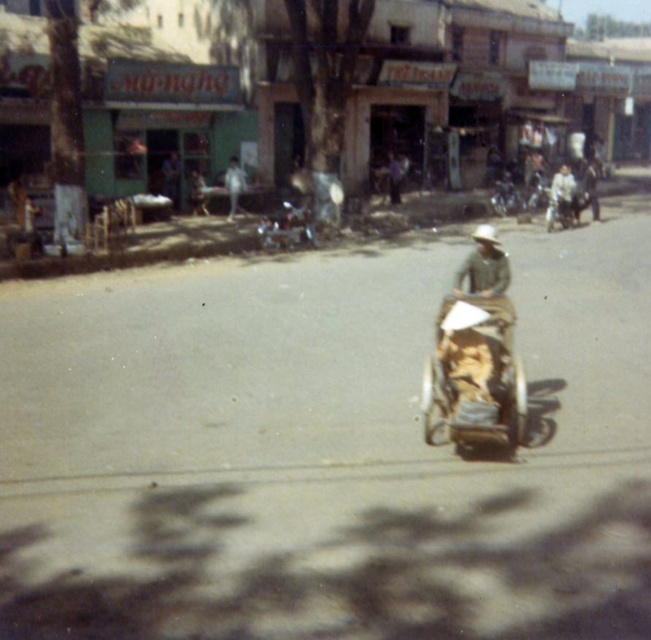
In the scene shown: Is wooden textured baby carriage at center wider than light brown leather jacket at center?

Incorrect, wooden textured baby carriage at center's width does not surpass light brown leather jacket at center's.

Locate an element on the screen. wooden textured baby carriage at center is located at coordinates (475, 372).

Identify the location of wooden textured baby carriage at center. The image size is (651, 640). (475, 372).

Between white fabric shirt at center and brown leather hat at center, which one has less height?

Standing shorter between the two is brown leather hat at center.

Describe the element at coordinates (234, 184) in the screenshot. I see `white fabric shirt at center` at that location.

At what (x,y) coordinates should I click in order to perform the action: click on white fabric shirt at center. Please return your answer as a coordinate pair (x, y). Image resolution: width=651 pixels, height=640 pixels. Looking at the image, I should click on (234, 184).

Does point (570, 209) lie behind point (398, 182)?

No, it is in front of (398, 182).

Is light brown leather jacket at center further to the viewer compared to brown leather hat at center?

A: No, light brown leather jacket at center is closer to the viewer.

Locate an element on the screen. light brown leather jacket at center is located at coordinates (562, 196).